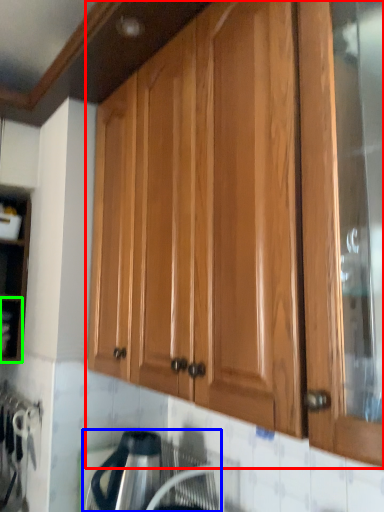
Question: Based on their relative distances, which object is farther from cabinetry (highlighted by a red box)? Choose from appliance (highlighted by a blue box) and shelf (highlighted by a green box).

Choices:
 (A) appliance
 (B) shelf

Answer: (B)